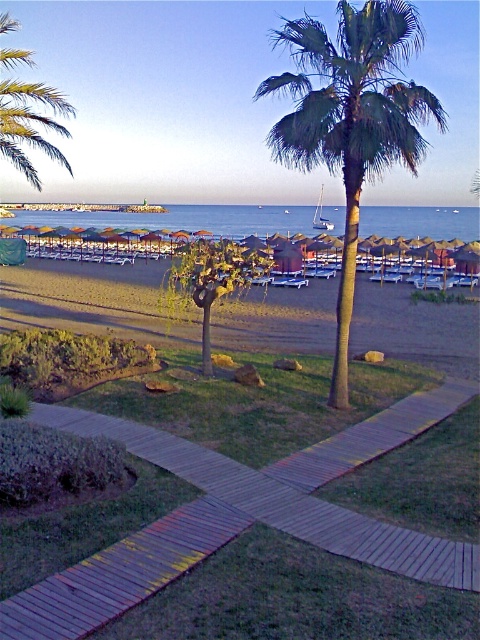
Question: Which object is positioned farthest from the wooden at center?

Choices:
 (A) beige sand beach at center
 (B) blue water at center
 (C) green leafy palm tree at center

Answer: (B)

Question: Is wooden at center above green leafy palm tree at center?

Choices:
 (A) no
 (B) yes

Answer: (A)

Question: Among these objects, which one is nearest to the camera?

Choices:
 (A) blue water at center
 (B) green leafy palm tree at center
 (C) wooden at center

Answer: (C)

Question: Can you confirm if wooden at center is wider than blue water at center?

Choices:
 (A) yes
 (B) no

Answer: (B)

Question: Does wooden at center have a larger size compared to green leafy palm tree at center?

Choices:
 (A) yes
 (B) no

Answer: (B)

Question: Which point is farther to the camera?

Choices:
 (A) green leafy palm tree at center
 (B) wooden at center
 (C) beige sand beach at center

Answer: (C)